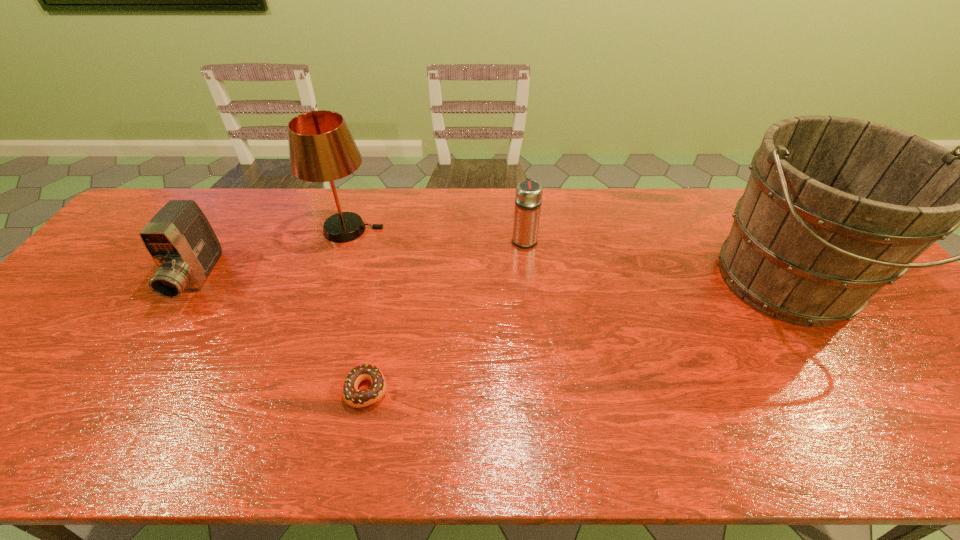
Where is `free spot that satisfies the following two spatial constraints: 1. on the front-facing side of the fourth object from right to left; 2. with a handle on the side of the fourth object from left to right`? The image size is (960, 540). free spot that satisfies the following two spatial constraints: 1. on the front-facing side of the fourth object from right to left; 2. with a handle on the side of the fourth object from left to right is located at coordinates (346, 239).

At what (x,y) coordinates should I click in order to perform the action: click on blank space that satisfies the following two spatial constraints: 1. on the front-facing side of the lampshade; 2. with a handle on the side of the second object from right to left. Please return your answer as a coordinate pair (x, y). Looking at the image, I should click on (346, 239).

At what (x,y) coordinates should I click in order to perform the action: click on vacant space that satisfies the following two spatial constraints: 1. on the front-facing side of the lampshade; 2. at the front of the camcorder, highlighting the lens. Please return your answer as a coordinate pair (x, y). Looking at the image, I should click on (332, 279).